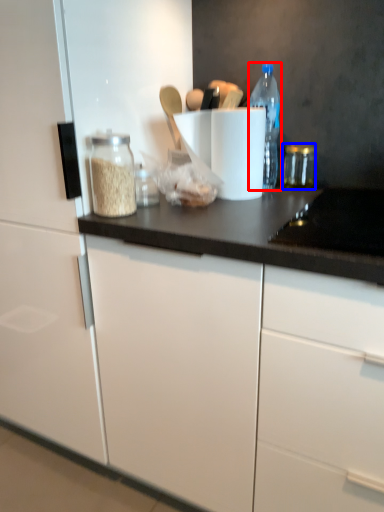
Question: Which of the following is the farthest to the observer, bottle (highlighted by a red box) or glass jar (highlighted by a blue box)?

Choices:
 (A) bottle
 (B) glass jar

Answer: (B)